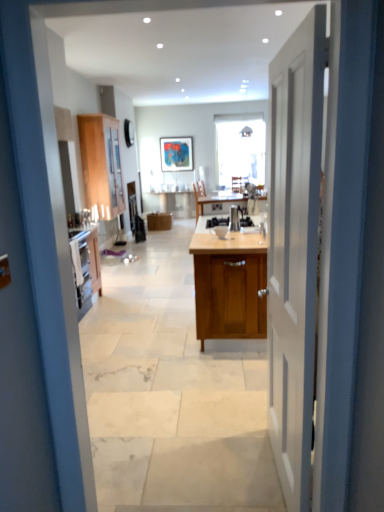
The height and width of the screenshot is (512, 384). In order to click on vacant space behind white wooden door at center in this screenshot , I will do pyautogui.click(x=226, y=418).